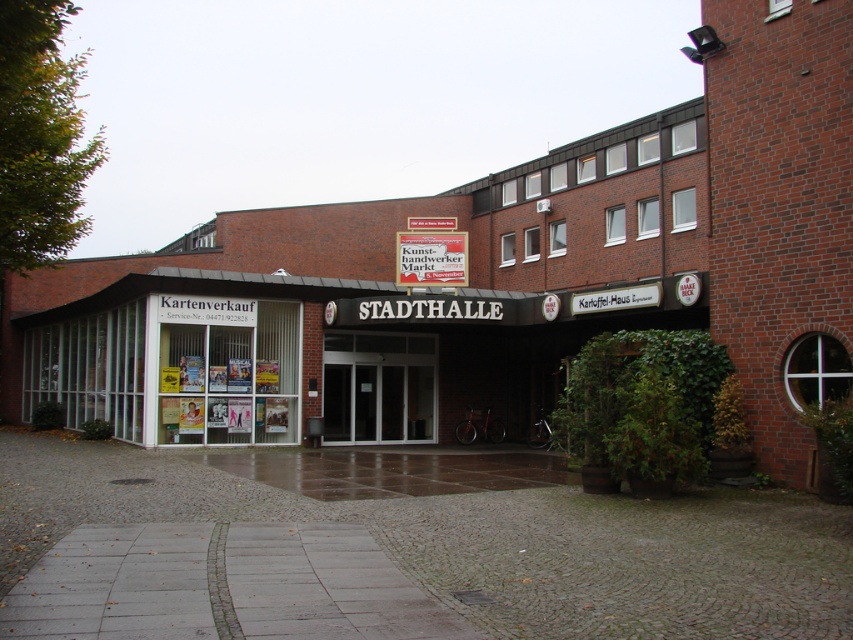
You are a delivery person trying to park your 2.5 meter long van in front of the STADTHALLE building. The gray cobblestone pavement at center and the white glass storefront at center are in your path. Which area should you avoid to ensure your van fits?

The gray cobblestone pavement at center is shorter than the white glass storefront at center, so you should avoid parking on the gray cobblestone pavement at center as it may not accommodate the van length.

You are a delivery person trying to enter the STADTHALLE building. You see a transparent glass door at center and a red cardboard sign at center. Which object is taller?

The transparent glass door at center is taller than the red cardboard sign at center according to the description.